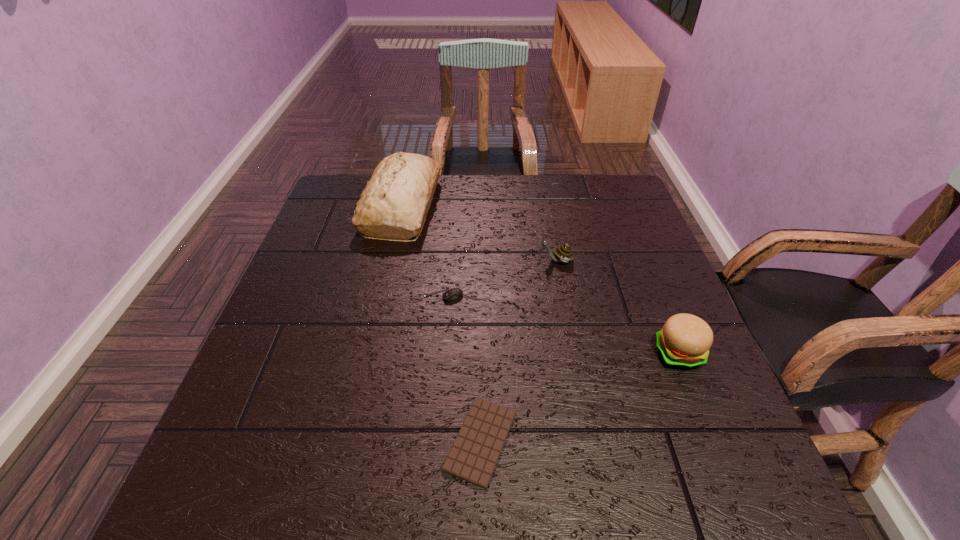
The image size is (960, 540). I want to click on blank space that satisfies the following two spatial constraints: 1. on the face of the snail; 2. on the right side of the rightmost object, so click(x=574, y=353).

The image size is (960, 540). Identify the location of free point that satisfies the following two spatial constraints: 1. on the face of the hamburger; 2. on the right side of the second farthest object. (574, 353).